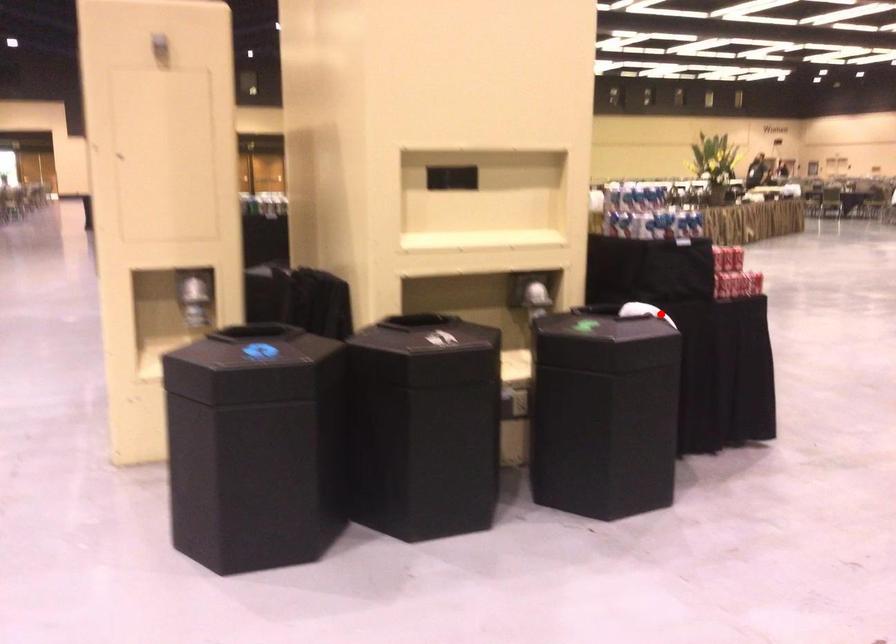
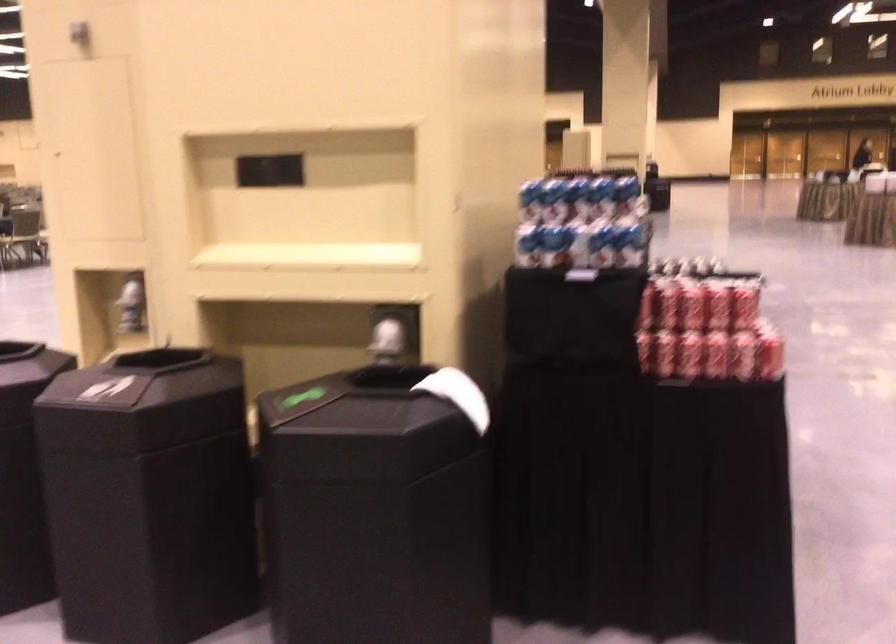
The point at the highlighted location is marked in the first image. Where is the corresponding point in the second image?

(458, 395)